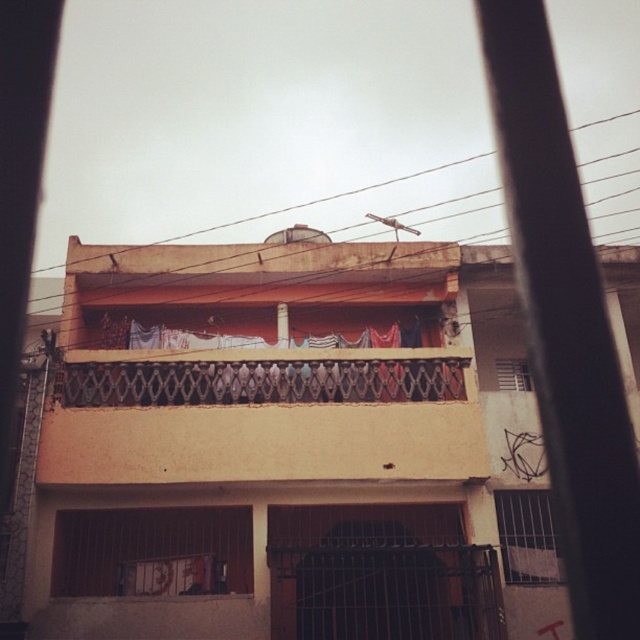
You are standing in a room with a window that has a view of a building. You see white metal bars at lower right and white fabric laundry at center. From your perspective, which object is closer to the right side of the window?

The white metal bars at lower right are closer to the right side of the window since they are positioned to the right of the white fabric laundry at center.

A drone is flying at a height of 10 meters. It wants to take a photo of the point at coordinates point [516,541]. The drone is currently at the position of the satellite dish mounted on the roof. Can the drone safely descend to take the photo without hitting any obstacles?

The point at coordinates point [516,541] is 11.16 meters away from the satellite dish. Since the drone is flying at 10 meters, it cannot safely descend to take the photo as the distance required exceeds its current altitude.